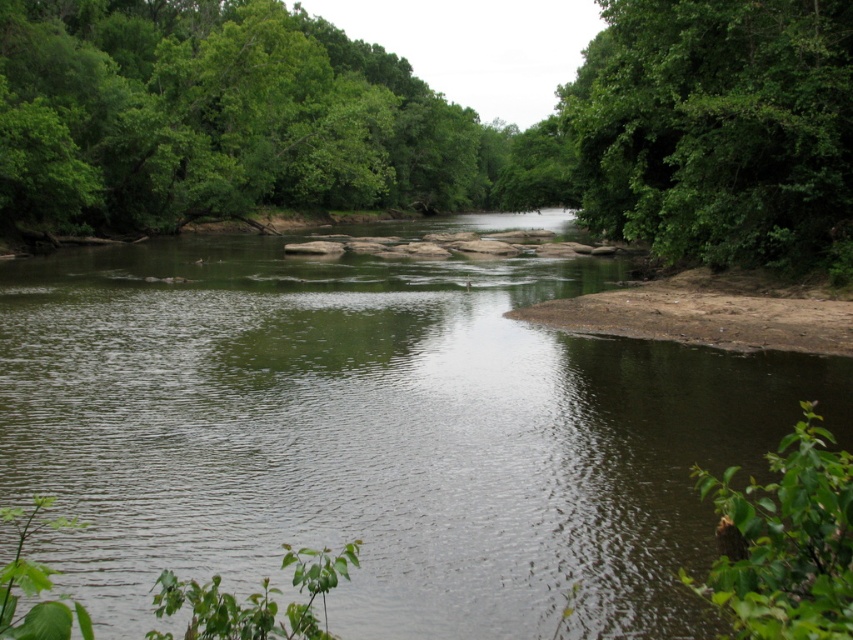
Question: Which point is farther to the camera?

Choices:
 (A) green leafy tree at center
 (B) green leafy tree at upper right
 (C) green smooth water at center

Answer: (A)

Question: Is green smooth water at center behind green leafy tree at center?

Choices:
 (A) yes
 (B) no

Answer: (B)

Question: Can you confirm if green smooth water at center is positioned below green leafy tree at center?

Choices:
 (A) yes
 (B) no

Answer: (A)

Question: Which of the following is the closest to the observer?

Choices:
 (A) (747, 124)
 (B) (519, 216)
 (C) (38, 195)

Answer: (A)

Question: Does green smooth water at center appear over green leafy tree at upper right?

Choices:
 (A) no
 (B) yes

Answer: (A)

Question: Which point is closer to the camera taking this photo?

Choices:
 (A) (59, 44)
 (B) (793, 176)

Answer: (B)